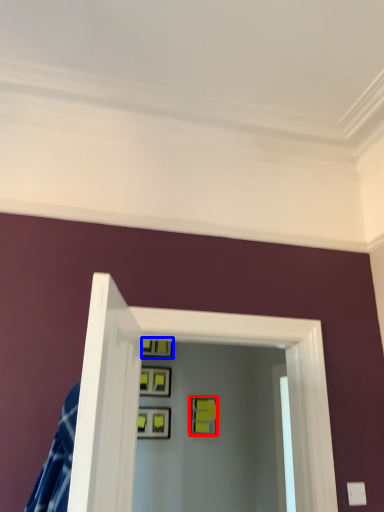
Question: Among these objects, which one is farthest to the camera, picture frame (highlighted by a red box) or picture frame (highlighted by a blue box)?

Choices:
 (A) picture frame
 (B) picture frame

Answer: (B)